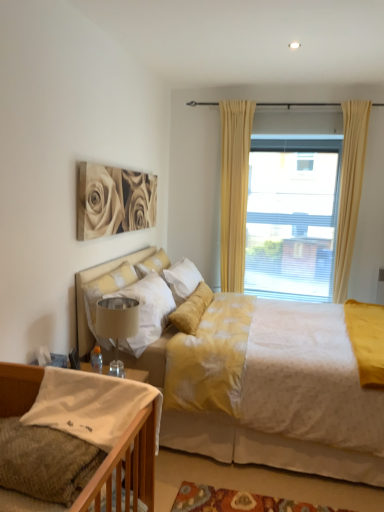
Question: From a real-world perspective, is white cotton pillow at lower left, placed as the 1th pillow when sorted from bottom to top, on matte beige roses at upper left?

Choices:
 (A) no
 (B) yes

Answer: (A)

Question: Is white cotton pillow at lower left, which is the 1th pillow from front to back, wider than matte beige roses at upper left?

Choices:
 (A) no
 (B) yes

Answer: (B)

Question: Considering the relative sizes of white cotton pillow at lower left, placed as the 1th pillow when sorted from bottom to top, and matte beige roses at upper left in the image provided, is white cotton pillow at lower left, placed as the 1th pillow when sorted from bottom to top, thinner than matte beige roses at upper left?

Choices:
 (A) no
 (B) yes

Answer: (A)

Question: Does white cotton pillow at lower left, positioned as the third pillow in top-to-bottom order, have a larger size compared to matte beige roses at upper left?

Choices:
 (A) no
 (B) yes

Answer: (A)

Question: Does white cotton pillow at lower left, positioned as the third pillow in top-to-bottom order, have a lesser height compared to matte beige roses at upper left?

Choices:
 (A) yes
 (B) no

Answer: (A)

Question: Is yellow fabric curtain at upper center, the 2th curtain positioned from the right, to the left or to the right of knitted fabric bed at lower left, the 1th bed when ordered from front to back, in the image?

Choices:
 (A) right
 (B) left

Answer: (A)

Question: In terms of width, does yellow fabric curtain at upper center, which is the first curtain from left to right, look wider or thinner when compared to knitted fabric bed at lower left, the 1th bed when ordered from front to back?

Choices:
 (A) thin
 (B) wide

Answer: (A)

Question: Is point (236, 144) closer or farther from the camera than point (102, 473)?

Choices:
 (A) closer
 (B) farther

Answer: (B)

Question: From the image's perspective, relative to knitted fabric bed at lower left, acting as the 2th bed starting from the back, is yellow fabric curtain at upper center, the 2th curtain positioned from the right, above or below?

Choices:
 (A) above
 (B) below

Answer: (A)

Question: Considering the relative positions of soft white pillow at center, the third pillow ordered from the bottom, and beige fabric lampshade at lower center in the image provided, is soft white pillow at center, the third pillow ordered from the bottom, to the left or to the right of beige fabric lampshade at lower center?

Choices:
 (A) right
 (B) left

Answer: (A)

Question: Is soft white pillow at center, the third pillow from the front, inside or outside of beige fabric lampshade at lower center?

Choices:
 (A) outside
 (B) inside

Answer: (A)

Question: Considering their positions, is soft white pillow at center, the third pillow ordered from the bottom, located in front of or behind beige fabric lampshade at lower center?

Choices:
 (A) front
 (B) behind

Answer: (B)

Question: From a real-world perspective, is soft white pillow at center, the third pillow ordered from the bottom, physically located above or below beige fabric lampshade at lower center?

Choices:
 (A) below
 (B) above

Answer: (B)

Question: From a real-world perspective, relative to beige fabric curtain at upper right, placed as the second curtain when sorted from left to right, is soft white pillow at center, arranged as the first pillow when viewed from the back, vertically above or below?

Choices:
 (A) above
 (B) below

Answer: (B)

Question: Looking at the image, does soft white pillow at center, the third pillow ordered from the bottom, seem bigger or smaller compared to beige fabric curtain at upper right, placed as the second curtain when sorted from left to right?

Choices:
 (A) big
 (B) small

Answer: (B)